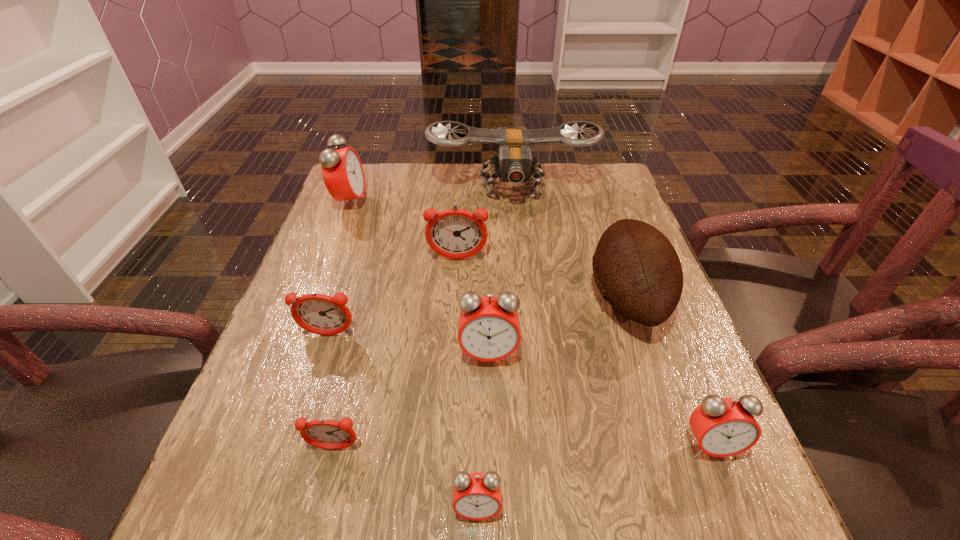
Identify the location of object that is at the far right corner. (514, 163).

Find the location of a particular element. This screenshot has height=540, width=960. free location at the far edge of the desktop is located at coordinates (x=396, y=184).

What are the coordinates of `blank area at the right edge` in the screenshot? It's located at (651, 421).

What are the coordinates of `free space at the far left corner` in the screenshot? It's located at (394, 179).

The height and width of the screenshot is (540, 960). In order to click on vacant space at the far right corner in this screenshot , I will do `click(569, 165)`.

Locate an element on the screen. Image resolution: width=960 pixels, height=540 pixels. vacant space at the near right corner of the desktop is located at coordinates (699, 515).

Where is `free space between the smallest reddish-pink alarm clock and the second farthest reddish-pink alarm clock`? This screenshot has height=540, width=960. free space between the smallest reddish-pink alarm clock and the second farthest reddish-pink alarm clock is located at coordinates point(331,392).

I want to click on blank region between the nearest red alarm clock and the brown football, so click(552, 403).

You are a GUI agent. You are given a task and a screenshot of the screen. Output one action in this format:
    pyautogui.click(x=<x>, y=<y>)
    Task: Click on the empty space between the smallest reddish-pink alarm clock and the football
    This screenshot has width=960, height=540.
    Given the screenshot: What is the action you would take?
    click(x=481, y=373)

Find the location of a particular element. This screenshot has width=960, height=540. vacant area that lies between the biggest reddish-pink alarm clock and the leftmost red alarm clock is located at coordinates (404, 231).